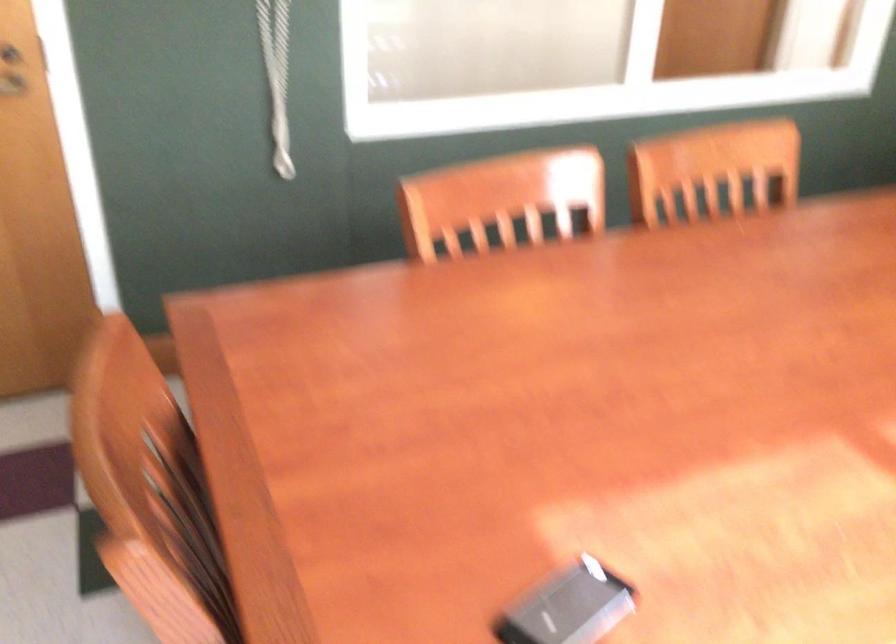
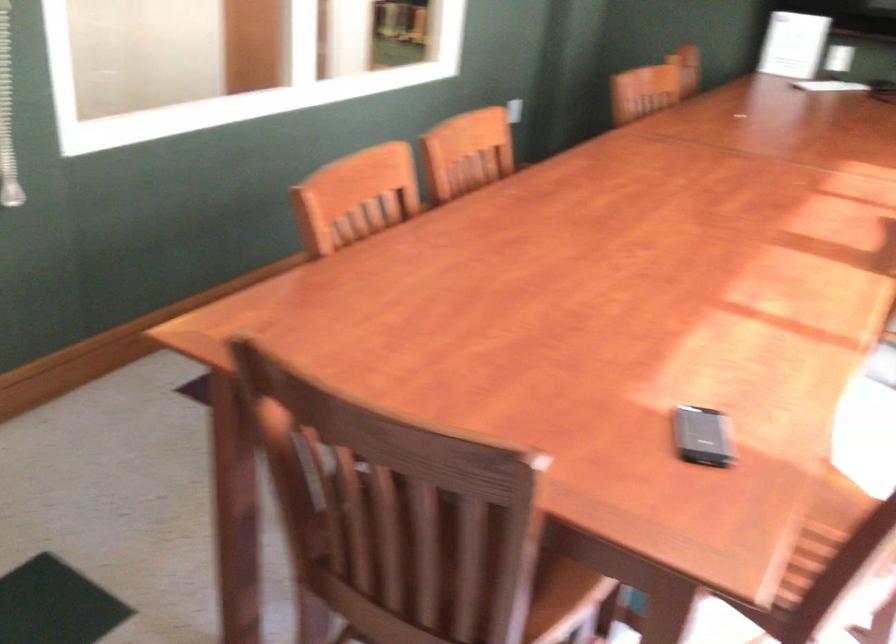
Question: The camera is either moving clockwise (left) or counter-clockwise (right) around the object. The first image is from the beginning of the video and the second image is from the end. Is the camera moving left or right when shooting the video?

Choices:
 (A) Left
 (B) Right

Answer: (A)